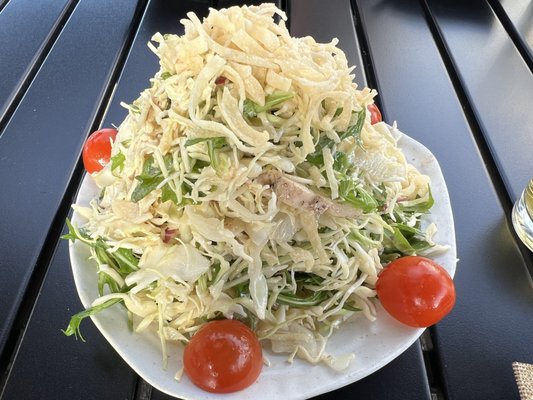
Where is `table`? The image size is (533, 400). table is located at coordinates pos(64,69).